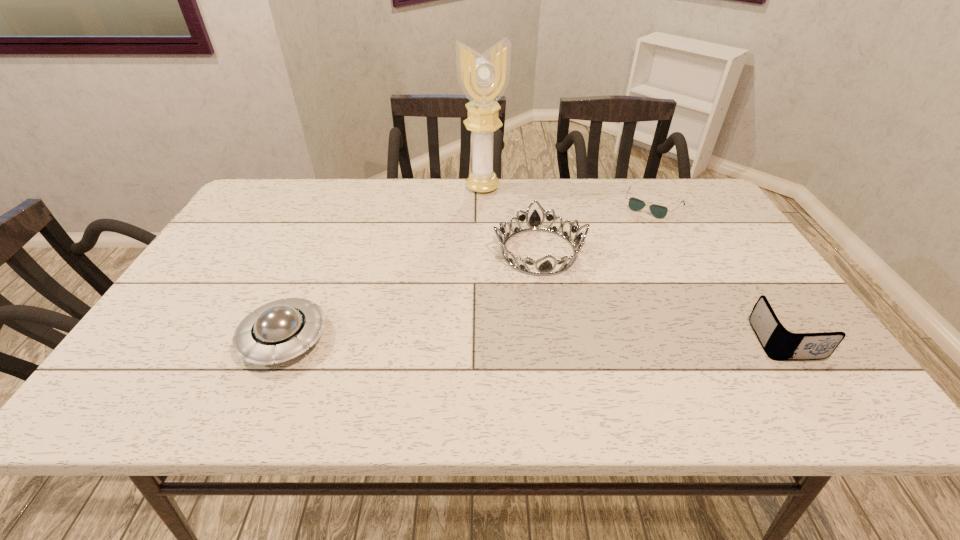
Select which object is the third closest to the shortest object. Please provide its 2D coordinates. Your answer should be formatted as a tuple, i.e. [(x, y)], where the tuple contains the x and y coordinates of a point satisfying the conditions above.

[(779, 344)]

Locate which object is the second closest to the wallet. Please provide its 2D coordinates. Your answer should be formatted as a tuple, i.e. [(x, y)], where the tuple contains the x and y coordinates of a point satisfying the conditions above.

[(658, 211)]

Find the location of a particular element. This screenshot has height=540, width=960. free space that satisfies the following two spatial constraints: 1. on the front side of the wallet; 2. on the outer surface of the tiara is located at coordinates (553, 340).

This screenshot has width=960, height=540. Identify the location of free space that satisfies the following two spatial constraints: 1. on the front side of the wallet; 2. on the outer surface of the third nearest object. (553, 340).

Locate an element on the screen. This screenshot has width=960, height=540. free space that satisfies the following two spatial constraints: 1. on the front side of the tallest object; 2. on the outer surface of the wallet is located at coordinates (484, 340).